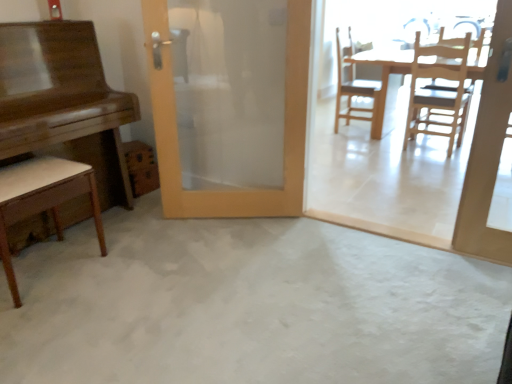
Locate an element on the screen. The height and width of the screenshot is (384, 512). light brown wood chair at lower left, which appears as the 3th chair when viewed from the right is located at coordinates (42, 199).

In order to face light brown wood chair at lower left, which appears as the 3th chair when viewed from the right, should I rotate leftwards or rightwards?

It's best to rotate left around 27.360 degrees.

Identify the location of wooden door at center. (284, 129).

The width and height of the screenshot is (512, 384). Identify the location of wooden at right, the second chair in the right-to-left sequence. coord(353,87).

The height and width of the screenshot is (384, 512). What are the coordinates of `light brown wood chair at lower left, arranged as the first chair when viewed from the left` in the screenshot? It's located at (42, 199).

From the image's perspective, is light wood table at center, marked as the 1th table in a back-to-front arrangement, on top of wooden at right, which is the second chair from left to right?

Answer: No, from the image's perspective, light wood table at center, marked as the 1th table in a back-to-front arrangement, is not over wooden at right, which is the second chair from left to right.

How far apart are light wood table at center, positioned as the 1th table in right-to-left order, and wooden at right, which is the third chair in front-to-back order?

light wood table at center, positioned as the 1th table in right-to-left order, and wooden at right, which is the third chair in front-to-back order, are 21.08 centimeters apart.

From a real-world perspective, is light wood table at center, which is the 2th table in front-to-back order, located beneath wooden at right, which is the third chair in front-to-back order?

Yes, from a real-world perspective, light wood table at center, which is the 2th table in front-to-back order, is under wooden at right, which is the third chair in front-to-back order.

Based on their positions, is light wood table at center, marked as the 1th table in a back-to-front arrangement, located to the left or right of wooden at right, which is the third chair in front-to-back order?

light wood table at center, marked as the 1th table in a back-to-front arrangement, is to the right of wooden at right, which is the third chair in front-to-back order.

Does wooden at right, which ranks as the 1th chair in back-to-front order, lie behind shiny brown piano at left, positioned as the first table in left-to-right order?

That is True.

Which object is thinner, wooden at right, which ranks as the 1th chair in back-to-front order, or shiny brown piano at left, positioned as the first table in left-to-right order?

wooden at right, which ranks as the 1th chair in back-to-front order, is thinner.

How many degrees apart are the facing directions of wooden at right, which ranks as the 1th chair in back-to-front order, and shiny brown piano at left, which is counted as the second table, starting from the back?

There is a 0.245-degree angle between the facing directions of wooden at right, which ranks as the 1th chair in back-to-front order, and shiny brown piano at left, which is counted as the second table, starting from the back.

From a real-world perspective, which object rests below the other?

white concrete floor at center, from a real-world perspective.

Which of these two, wooden chair at right, placed as the 2th chair when sorted from front to back, or white concrete floor at center, is smaller?

Smaller between the two is white concrete floor at center.

Looking at this image, from the image's perspective, which one is positioned higher, wooden chair at right, the 2th chair from the back, or white concrete floor at center?

From the image's view, wooden chair at right, the 2th chair from the back, is above.

Is wooden chair at right, placed as the 2th chair when sorted from front to back, in contact with white concrete floor at center?

They are not placed beside each other.

Is wooden at right, which is the third chair in front-to-back order, in contact with light wood table at center, the second table when ordered from left to right?

No.

From a real-world perspective, between wooden at right, which is the third chair in front-to-back order, and light wood table at center, positioned as the 1th table in right-to-left order, who is vertically higher?

In real-world perspective, wooden at right, which is the third chair in front-to-back order, is above.

Do you think wooden at right, which ranks as the 1th chair in back-to-front order, is within light wood table at center, positioned as the 1th table in right-to-left order, or outside of it?

wooden at right, which ranks as the 1th chair in back-to-front order, is spatially positioned inside light wood table at center, positioned as the 1th table in right-to-left order.

From a real-world perspective, is wooden door at center located beneath light wood table at center, marked as the 1th table in a back-to-front arrangement?

No, from a real-world perspective, wooden door at center is not below light wood table at center, marked as the 1th table in a back-to-front arrangement.

Is wooden door at center oriented away from light wood table at center, positioned as the 1th table in right-to-left order?

No, wooden door at center's orientation is not away from light wood table at center, positioned as the 1th table in right-to-left order.

Is wooden door at center not inside light wood table at center, the second table when ordered from left to right?

Absolutely, wooden door at center is external to light wood table at center, the second table when ordered from left to right.

Between point (258, 216) and point (471, 76), which one is positioned behind?

Point (471, 76)

You are a GUI agent. You are given a task and a screenshot of the screen. Output one action in this format:
    pyautogui.click(x=<x>, y=<y>)
    Task: Click on the table that is below the wooden chair at right, the 3th chair from the left (from the image's perspective)
    This screenshot has height=384, width=512.
    Given the screenshot: What is the action you would take?
    pyautogui.click(x=64, y=102)

Is shiny brown piano at left, which appears as the 2th table when viewed from the right, closer to camera compared to wooden chair at right, placed as the 2th chair when sorted from front to back?

Yes, it is in front of wooden chair at right, placed as the 2th chair when sorted from front to back.

Which object is positioned more to the right, shiny brown piano at left, which is the first table in front-to-back order, or wooden chair at right, the first chair viewed from the right?

Positioned to the right is wooden chair at right, the first chair viewed from the right.

Which is more to the right, light wood table at center, which is the 2th table in front-to-back order, or shiny brown piano at left, which is counted as the second table, starting from the back?

light wood table at center, which is the 2th table in front-to-back order.

How many degrees apart are the facing directions of light wood table at center, the second table when ordered from left to right, and shiny brown piano at left, which is the first table in front-to-back order?

The facing directions of light wood table at center, the second table when ordered from left to right, and shiny brown piano at left, which is the first table in front-to-back order, are 180 degrees apart.

Can we say light wood table at center, marked as the 1th table in a back-to-front arrangement, lies outside shiny brown piano at left, which is counted as the second table, starting from the back?

Yes.

Between light wood table at center, marked as the 1th table in a back-to-front arrangement, and shiny brown piano at left, which is the first table in front-to-back order, which one has larger width?

light wood table at center, marked as the 1th table in a back-to-front arrangement, is wider.

Where is `chair behind the light wood table at center, which is the 2th table in front-to-back order`? The width and height of the screenshot is (512, 384). chair behind the light wood table at center, which is the 2th table in front-to-back order is located at coordinates (353, 87).

Locate an element on the screen. The image size is (512, 384). the 2nd table below the wooden at right, the second chair in the right-to-left sequence (from the image's perspective) is located at coordinates [64, 102].

When comparing their distances from wooden at right, the second chair in the right-to-left sequence, does light brown wood chair at lower left, which is the first chair from front to back, or wooden chair at right, the first chair viewed from the right, seem further?

light brown wood chair at lower left, which is the first chair from front to back, lies further to wooden at right, the second chair in the right-to-left sequence, than the other object.

Based on the photo, when comparing their distances from light brown wood chair at lower left, arranged as the first chair when viewed from the left, does wooden door at center or wooden chair at right, placed as the 2th chair when sorted from front to back, seem closer?

wooden door at center is positioned closer to the anchor light brown wood chair at lower left, arranged as the first chair when viewed from the left.

Based on their spatial positions, is wooden at right, which ranks as the 1th chair in back-to-front order, or light wood table at center, which is the 2th table in front-to-back order, further from wooden chair at right, the 3th chair from the left?

wooden at right, which ranks as the 1th chair in back-to-front order, is further to wooden chair at right, the 3th chair from the left.

Looking at the image, which one is located further to light wood table at center, marked as the 1th table in a back-to-front arrangement, wooden chair at right, the 3th chair from the left, or wooden at right, which is the second chair from left to right?

Based on the image, wooden chair at right, the 3th chair from the left, appears to be further to light wood table at center, marked as the 1th table in a back-to-front arrangement.

Based on their spatial positions, is wooden chair at right, the first chair viewed from the right, or wooden door at center closer to white concrete floor at center?

Among the two, wooden door at center is located nearer to white concrete floor at center.

Looking at the image, which one is located closer to light brown wood chair at lower left, which is the first chair from front to back, white concrete floor at center or wooden door at center?

white concrete floor at center.

From the image, which object appears to be nearer to shiny brown piano at left, which appears as the 2th table when viewed from the right, wooden chair at right, placed as the 2th chair when sorted from front to back, or wooden door at center?

wooden door at center is closer to shiny brown piano at left, which appears as the 2th table when viewed from the right.

Based on their spatial positions, is wooden door at center or wooden chair at right, placed as the 2th chair when sorted from front to back, closer to light wood table at center, the second table when ordered from left to right?

wooden chair at right, placed as the 2th chair when sorted from front to back, is positioned closer to the anchor light wood table at center, the second table when ordered from left to right.

The image size is (512, 384). I want to click on concrete between shiny brown piano at left, which is the first table in front-to-back order, and light wood table at center, positioned as the 1th table in right-to-left order, in the horizontal direction, so click(249, 306).

Identify the location of chair situated between light brown wood chair at lower left, arranged as the first chair when viewed from the left, and wooden chair at right, the 3th chair from the left, from left to right. The width and height of the screenshot is (512, 384). (353, 87).

I want to click on door between shiny brown piano at left, which appears as the 2th table when viewed from the right, and wooden chair at right, the 2th chair from the back, so click(x=284, y=129).

This screenshot has height=384, width=512. I want to click on door between white concrete floor at center and light wood table at center, the second table when ordered from left to right, along the z-axis, so click(x=284, y=129).